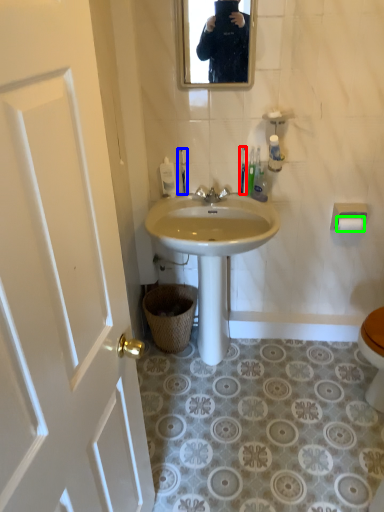
Question: Estimate the real-world distances between objects in this image. Which object is farther from toilet brush (highlighted by a red box), toilet brush (highlighted by a blue box) or toilet paper (highlighted by a green box)?

Choices:
 (A) toilet brush
 (B) toilet paper

Answer: (B)